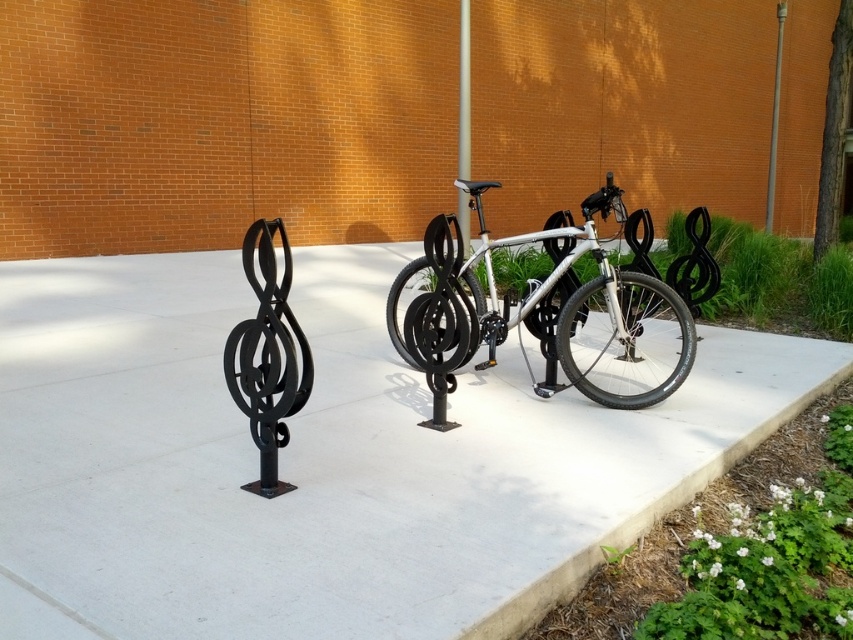
Which is below, silver metallic bicycle at center or black wrought iron treble clef at left?

black wrought iron treble clef at left

Is point (549, 346) farther from camera compared to point (234, 380)?

Yes, it is behind point (234, 380).

Find the location of a particular element. The width and height of the screenshot is (853, 640). silver metallic bicycle at center is located at coordinates (543, 310).

Is white concrete pavement at center bigger than gray metallic pole at upper right?

No.

Describe the element at coordinates (325, 460) in the screenshot. I see `white concrete pavement at center` at that location.

Is point (720, 368) closer to viewer compared to point (772, 204)?

Yes, point (720, 368) is closer to viewer.

The image size is (853, 640). Find the location of `white concrete pavement at center`. white concrete pavement at center is located at coordinates (325, 460).

Which is above, silver metallic pole at center or gray metallic pole at upper right?

Positioned higher is gray metallic pole at upper right.

What do you see at coordinates (463, 92) in the screenshot?
I see `silver metallic pole at center` at bounding box center [463, 92].

Is point (459, 38) in front of point (772, 164)?

Yes, point (459, 38) is closer to viewer.

Locate an element on the screen. The width and height of the screenshot is (853, 640). silver metallic pole at center is located at coordinates (463, 92).